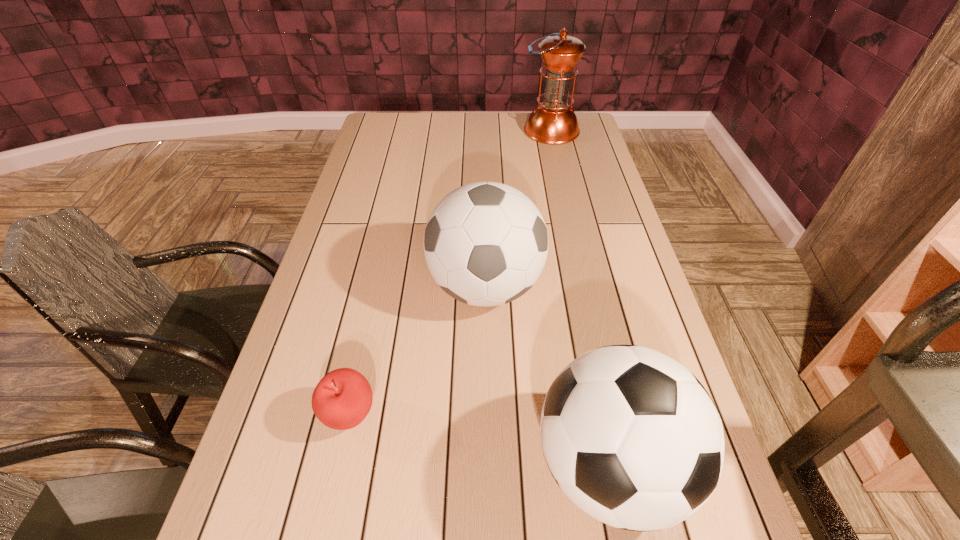
Identify the location of the farthest object. (553, 122).

I want to click on oil lamp, so click(x=553, y=122).

Locate an element on the screen. Image resolution: width=960 pixels, height=540 pixels. the third nearest object is located at coordinates (485, 243).

The width and height of the screenshot is (960, 540). What are the coordinates of `apple` in the screenshot? It's located at (342, 399).

The width and height of the screenshot is (960, 540). I want to click on the leftmost object, so pyautogui.click(x=342, y=399).

Locate an element on the screen. The height and width of the screenshot is (540, 960). free region located 0.230m on the left of the tallest object is located at coordinates (465, 131).

At what (x,y) coordinates should I click in order to perform the action: click on blank space located 0.210m on the left of the farther soccer ball. Please return your answer as a coordinate pair (x, y). Looking at the image, I should click on (348, 287).

Identify the location of free region located on the back of the shortest object. This screenshot has height=540, width=960. (382, 266).

I want to click on object present at the far edge, so click(553, 122).

Locate an element on the screen. The width and height of the screenshot is (960, 540). object that is at the left edge is located at coordinates (342, 399).